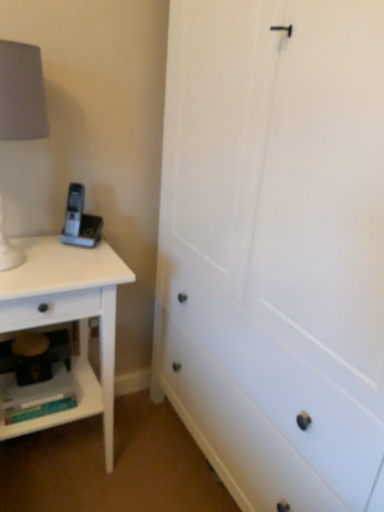
Question: Is white matte lampshade at left with matte plastic shelf at lower left?

Choices:
 (A) no
 (B) yes

Answer: (A)

Question: Is white matte lampshade at left completely or partially outside of matte plastic shelf at lower left?

Choices:
 (A) yes
 (B) no

Answer: (A)

Question: From a real-world perspective, is white matte lampshade at left located higher than matte plastic shelf at lower left?

Choices:
 (A) no
 (B) yes

Answer: (B)

Question: Is white matte lampshade at left in front of matte plastic shelf at lower left?

Choices:
 (A) no
 (B) yes

Answer: (B)

Question: From the image's perspective, is white matte lampshade at left below matte plastic shelf at lower left?

Choices:
 (A) no
 (B) yes

Answer: (A)

Question: Considering the relative sizes of white matte lampshade at left and matte plastic shelf at lower left in the image provided, is white matte lampshade at left thinner than matte plastic shelf at lower left?

Choices:
 (A) no
 (B) yes

Answer: (A)

Question: Is matte plastic shelf at lower left thinner than white matte lampshade at left?

Choices:
 (A) yes
 (B) no

Answer: (A)

Question: Is white matte lampshade at left at the back of matte plastic shelf at lower left?

Choices:
 (A) no
 (B) yes

Answer: (A)

Question: Can you confirm if matte plastic shelf at lower left is positioned to the left of white matte lampshade at left?

Choices:
 (A) yes
 (B) no

Answer: (A)

Question: Is matte plastic shelf at lower left completely or partially outside of white matte lampshade at left?

Choices:
 (A) yes
 (B) no

Answer: (A)

Question: From a real-world perspective, is matte plastic shelf at lower left located higher than white matte lampshade at left?

Choices:
 (A) no
 (B) yes

Answer: (A)

Question: Considering the relative sizes of matte plastic shelf at lower left and white matte lampshade at left in the image provided, is matte plastic shelf at lower left wider than white matte lampshade at left?

Choices:
 (A) yes
 (B) no

Answer: (B)

Question: Is white matte lampshade at left taller than white matte nightstand at left?

Choices:
 (A) yes
 (B) no

Answer: (B)